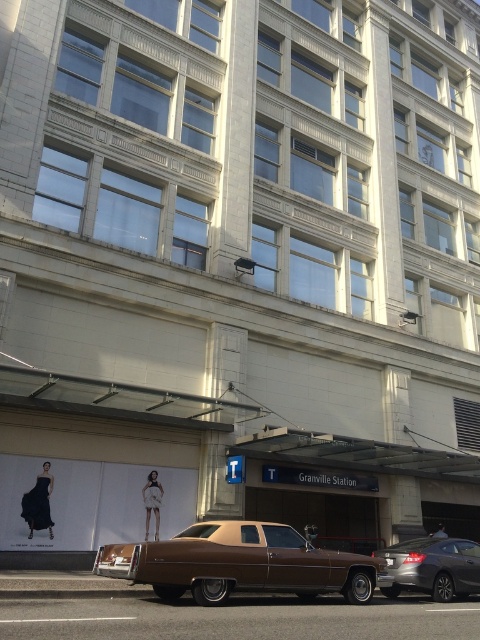
You are a pedestrian standing on the sidewalk in front of the building. You see a brown matte sedan at center and a silver metallic sedan at lower right. Which car is closer to you?

The brown matte sedan at center is closer to you because it is in front of the silver metallic sedan at lower right.

You are a delivery person needing to park your 1.8 meters tall package in the parking lot. The parking spot is between the brown matte sedan at center and the silver metallic sedan at lower right. Which vehicle should you park closer to so the package fits vertically without hitting the top?

The silver metallic sedan at lower right is shorter in height than the brown matte sedan at center. Therefore, you should park closer to the silver metallic sedan at lower right to ensure the 1.8 meters tall package fits vertically without hitting the top.

You are a delivery person trying to park your van between the brown matte sedan at center and the silver metallic sedan at lower right. The van is 2 meters wide. Can you fit your van between them?

The brown matte sedan at center might be wider than silver metallic sedan at lower right, making it uncertain if there is enough space for the van. Check the actual distance between them before attempting to park.